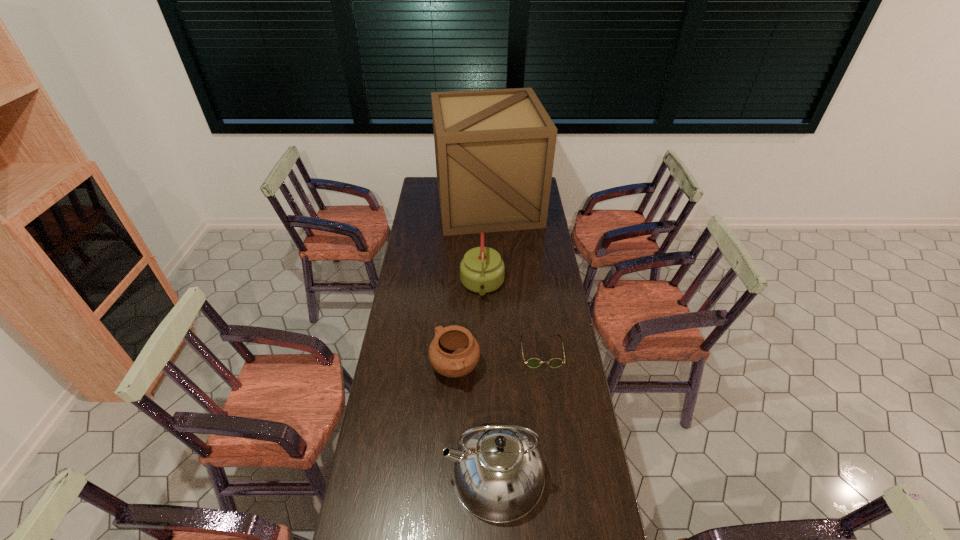
Locate an element on the screen. This screenshot has height=540, width=960. object at the far right corner is located at coordinates (494, 149).

Image resolution: width=960 pixels, height=540 pixels. Find the location of `blank area at the left edge`. blank area at the left edge is located at coordinates (414, 279).

In order to click on free space at the right edge of the desktop in this screenshot , I will do `click(561, 320)`.

Where is `free area in between the pottery and the farther kettle`? free area in between the pottery and the farther kettle is located at coordinates (468, 327).

The height and width of the screenshot is (540, 960). Find the location of `empty space between the third shortest object and the tallest object`. empty space between the third shortest object and the tallest object is located at coordinates (485, 245).

This screenshot has width=960, height=540. Find the location of `unoccupied area between the pottery and the spectacles`. unoccupied area between the pottery and the spectacles is located at coordinates (498, 360).

Where is `empty location between the spectacles and the nearest object`? empty location between the spectacles and the nearest object is located at coordinates (517, 413).

In order to click on free space between the third tallest object and the fourth tallest object in this screenshot , I will do (468, 327).

Where is `empty space that is in between the taller kettle and the fourth tallest object`? empty space that is in between the taller kettle and the fourth tallest object is located at coordinates (474, 421).

Locate an element on the screen. The width and height of the screenshot is (960, 540). free space between the taller kettle and the spectacles is located at coordinates (517, 413).